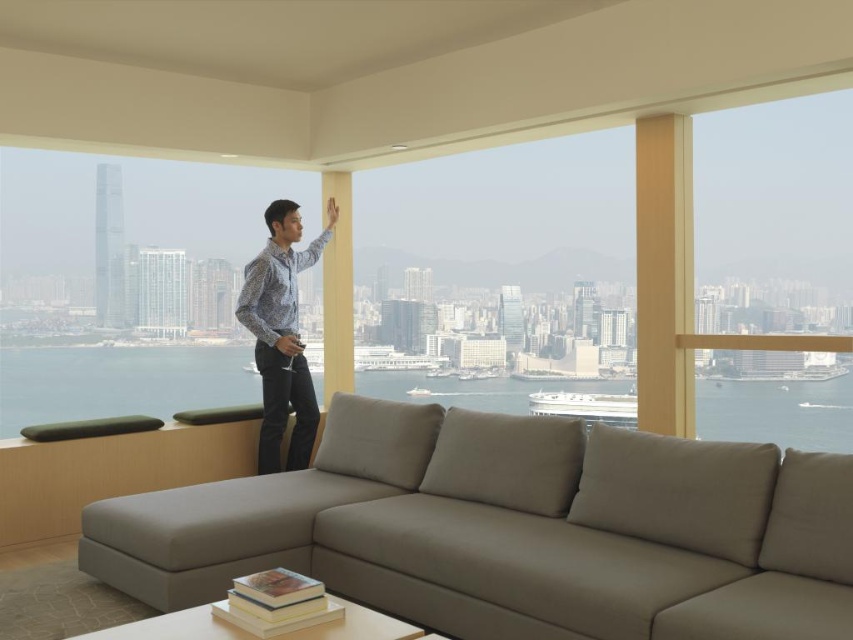
Question: Which of the following is the closest to the observer?

Choices:
 (A) clear glass window at upper right
 (B) patterned shirt at center

Answer: (A)

Question: Does transparent glass window at center have a larger size compared to clear glass window at upper right?

Choices:
 (A) no
 (B) yes

Answer: (B)

Question: Which object is positioned closest to the patterned shirt at center?

Choices:
 (A) transparent glass window at center
 (B) clear glass window at upper right

Answer: (A)

Question: Where is transparent glass window at upper left located in relation to transparent glass window at center in the image?

Choices:
 (A) left
 (B) right

Answer: (A)

Question: Does transparent glass window at center come behind clear glass window at upper right?

Choices:
 (A) no
 (B) yes

Answer: (B)

Question: Which is nearer to the beige fabric couch at lower center?

Choices:
 (A) transparent glass window at upper left
 (B) clear glass window at upper right
 (C) patterned shirt at center

Answer: (C)